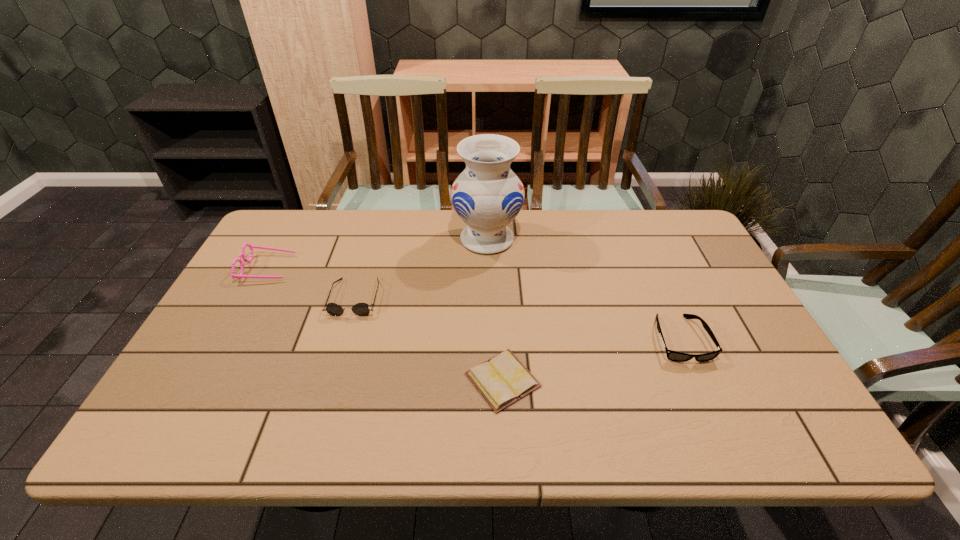
At what (x,y) coordinates should I click in order to perform the action: click on free space between the spectacles and the shortest object. Please return your answer as a coordinate pair (x, y). Looking at the image, I should click on (385, 324).

Where is `object that stands as the second closest to the leftmost object`? This screenshot has width=960, height=540. object that stands as the second closest to the leftmost object is located at coordinates (487, 196).

Identify the location of object that is the second closest to the diary. (671, 355).

Find the location of a particular element. The width and height of the screenshot is (960, 540). vacant area in the image that satisfies the following two spatial constraints: 1. on the front-facing side of the shortest object; 2. on the left side of the left sunglasses is located at coordinates (330, 380).

The width and height of the screenshot is (960, 540). In order to click on vacant region that satisfies the following two spatial constraints: 1. on the back side of the shortest object; 2. on the arms of the fourth shortest object in this screenshot , I will do `click(497, 268)`.

This screenshot has width=960, height=540. I want to click on vacant space that satisfies the following two spatial constraints: 1. on the front side of the vase; 2. on the left side of the shortest object, so click(490, 380).

The image size is (960, 540). What are the coordinates of `vacant point that satisfies the following two spatial constraints: 1. on the front-facing side of the left sunglasses; 2. on the right side of the diary` in the screenshot? It's located at (330, 380).

Where is `vacant space that satisfies the following two spatial constraints: 1. on the front side of the vase; 2. on the arms of the leftmost object`? vacant space that satisfies the following two spatial constraints: 1. on the front side of the vase; 2. on the arms of the leftmost object is located at coordinates (488, 268).